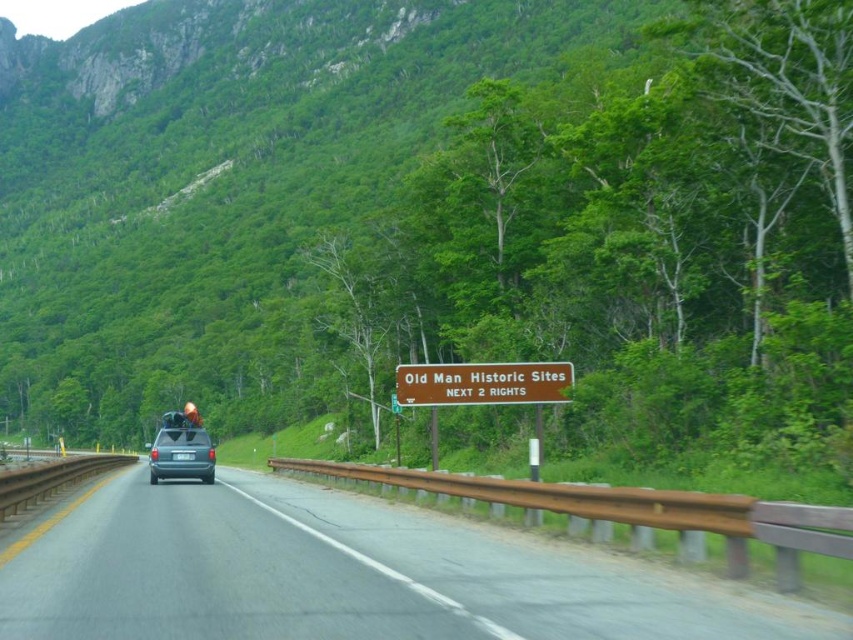
Is gray asphalt highway at center further to camera compared to brown wooden sign at center?

No, it is not.

Is gray asphalt highway at center shorter than brown wooden sign at center?

No, gray asphalt highway at center is not shorter than brown wooden sign at center.

Identify the location of gray asphalt highway at center. (351, 576).

The height and width of the screenshot is (640, 853). What are the coordinates of `gray asphalt highway at center` in the screenshot? It's located at (351, 576).

Is brown wooden sign at center taller than matte gray van at center?

No, brown wooden sign at center is not taller than matte gray van at center.

Locate an element on the screen. brown wooden sign at center is located at coordinates (482, 384).

This screenshot has height=640, width=853. In order to click on brown wooden sign at center in this screenshot , I will do `click(482, 384)`.

Between gray asphalt highway at center and matte gray van at center, which one appears on the left side from the viewer's perspective?

matte gray van at center is more to the left.

Is gray asphalt highway at center smaller than matte gray van at center?

Incorrect, gray asphalt highway at center is not smaller in size than matte gray van at center.

Who is more distant from viewer, (492, 577) or (207, 456)?

The point (207, 456) is behind.

Where is `gray asphalt highway at center`? The width and height of the screenshot is (853, 640). gray asphalt highway at center is located at coordinates click(351, 576).